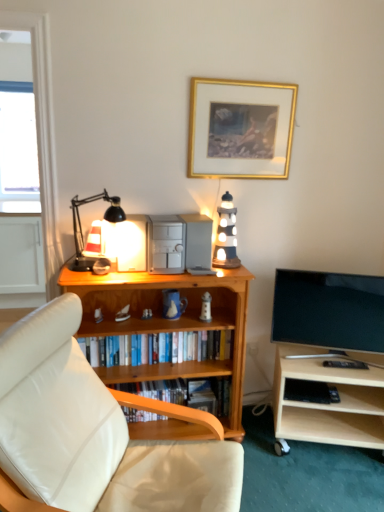
Find the location of a particular element. The image size is (384, 512). free space above light wood tv stand at lower right (from a real-world perspective) is located at coordinates (336, 359).